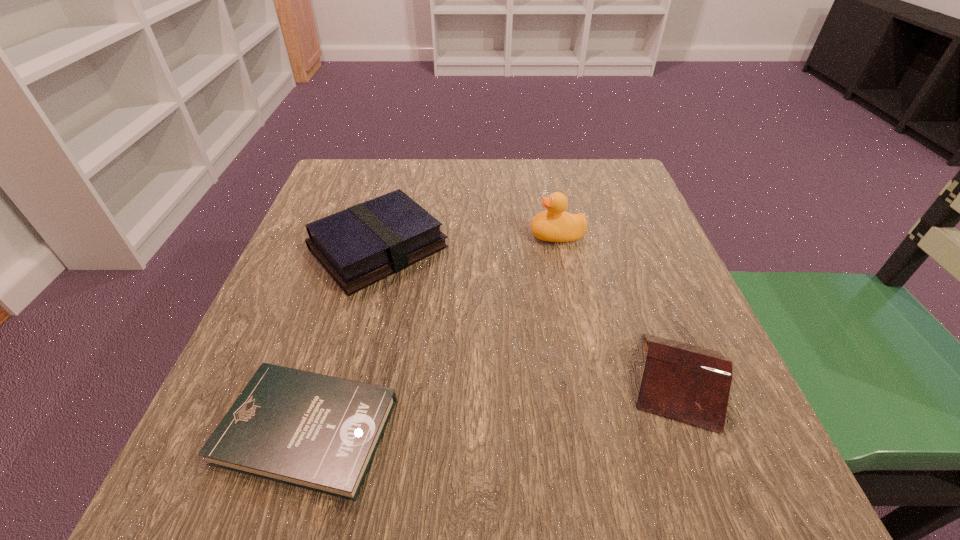
You are a GUI agent. You are given a task and a screenshot of the screen. Output one action in this format:
    pyautogui.click(x=<x>, y=<y>)
    Task: Click on the duck
    The width and height of the screenshot is (960, 540).
    Given the screenshot: What is the action you would take?
    pyautogui.click(x=554, y=224)

Locate an element on the screen. the tallest object is located at coordinates (554, 224).

The width and height of the screenshot is (960, 540). I want to click on the second tallest object, so click(x=365, y=243).

Find the location of a particular element. Image resolution: width=960 pixels, height=540 pixels. the tallest book is located at coordinates (365, 243).

Locate an element on the screen. The height and width of the screenshot is (540, 960). the rightmost object is located at coordinates (688, 383).

Image resolution: width=960 pixels, height=540 pixels. What are the coordinates of `the third tallest object` in the screenshot? It's located at (688, 383).

Find the location of `the shortest object`. the shortest object is located at coordinates (317, 432).

The width and height of the screenshot is (960, 540). I want to click on vacant point located 0.110m on the face of the third object from left to right, so click(x=478, y=235).

This screenshot has width=960, height=540. In order to click on blank space located on the face of the third object from left to right in this screenshot , I will do `click(460, 235)`.

Where is `free point located 0.340m on the face of the third object from left to right`? Image resolution: width=960 pixels, height=540 pixels. free point located 0.340m on the face of the third object from left to right is located at coordinates (370, 235).